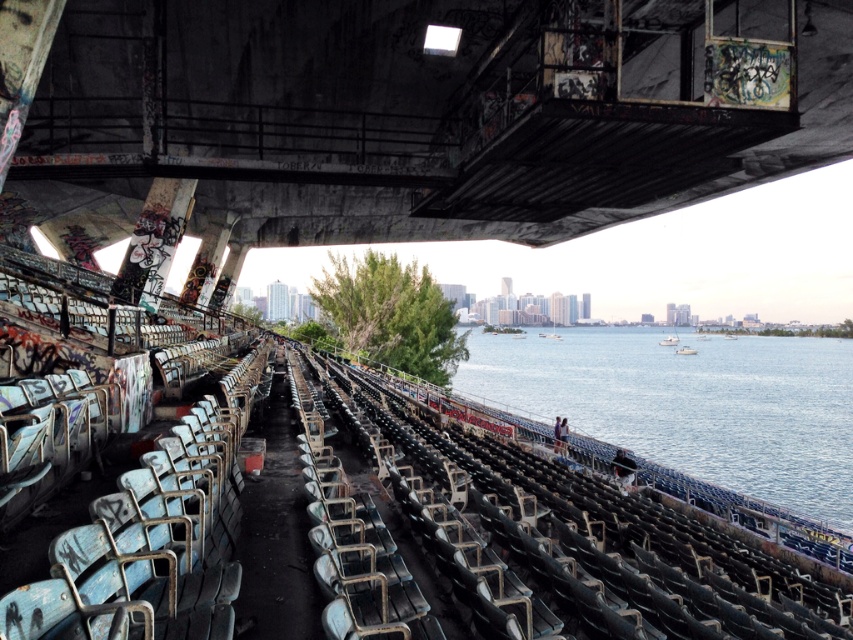
Is metallic blue seats at center positioned before blue water at center?

Yes, metallic blue seats at center is closer to the viewer.

Who is higher up, metallic blue seats at center or blue water at center?

metallic blue seats at center

Measure the distance between point (711, 611) and camera.

Point (711, 611) and camera are 6.04 meters apart from each other.

I want to click on metallic blue seats at center, so click(x=592, y=531).

Who is shorter, concrete textured overpass at upper center or metallic blue seats at center?

metallic blue seats at center

In the scene shown: Between concrete textured overpass at upper center and metallic blue seats at center, which one is positioned lower?

metallic blue seats at center is below.

Is point (659, 19) positioned after point (792, 572)?

That is True.

Locate an element on the screen. concrete textured overpass at upper center is located at coordinates (408, 113).

Can you confirm if concrete textured overpass at upper center is wider than blue water at center?

No.

You are a GUI agent. You are given a task and a screenshot of the screen. Output one action in this format:
    pyautogui.click(x=<x>, y=<y>)
    Task: Click on the concrete textured overpass at upper center
    This screenshot has height=640, width=853.
    Given the screenshot: What is the action you would take?
    pyautogui.click(x=408, y=113)